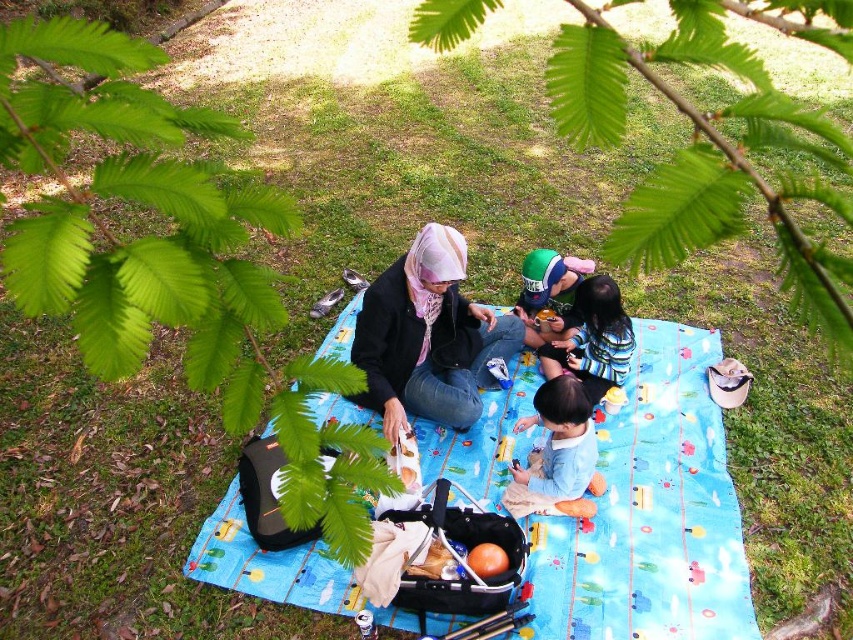
You are standing at the origin point of the coordinate system in the image. The picnic blanket is at coordinates 0.805, 0.764. If you want to walk straight towards the blue fabric picnic blanket at center, in which direction should you move?

Since the blue fabric picnic blanket at center is located at coordinates (651, 515), you should move towards the northeast direction to reach it.